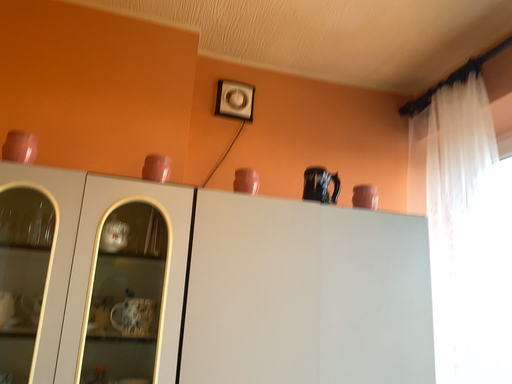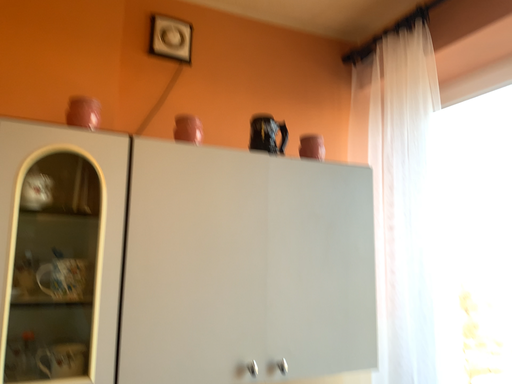
Question: How did the camera likely rotate when shooting the video?

Choices:
 (A) rotated downward
 (B) rotated upward

Answer: (A)